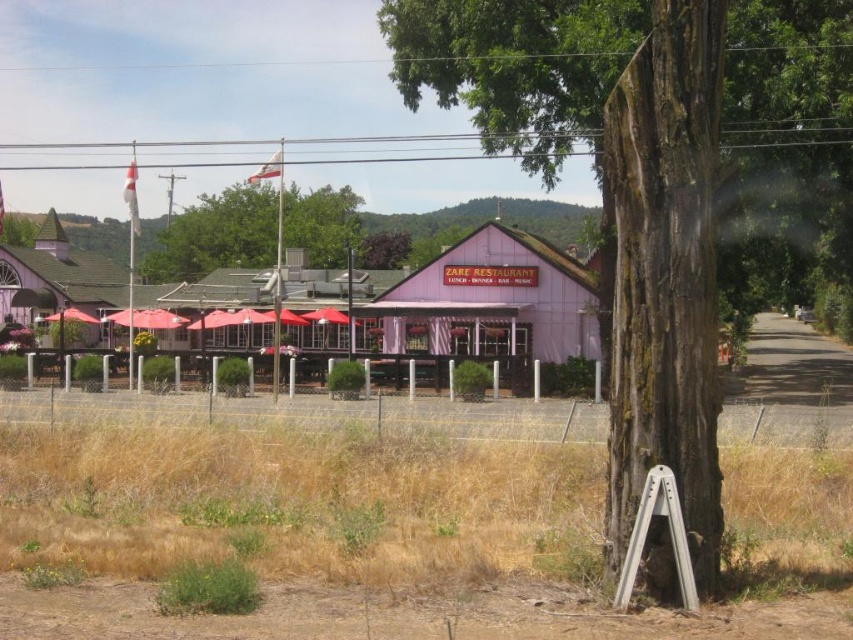
You are standing in front of the purple wood zare restaurant at center and want to take a photo of it with the smooth bark tree at center in the background. Given their sizes, will the tree block the restaurant in the photo?

The smooth bark tree at center is larger in size compared to the purple wood zare restaurant at center, so it will block the restaurant in the photo.

You are a delivery person who needs to park your 10 feet wide delivery truck between the smooth bark tree at center and the matte white tent at left. Is there enough space between them to park your truck?

The smooth bark tree at center and the matte white tent at left are 82.49 feet apart from each other, so yes, the delivery truck can park between them since the distance is more than enough for its 10 feet width.

You are standing in front of the purple wood zare restaurant at center and want to walk towards the smooth bark tree at center. Which direction should you move?

You should move to your right because the smooth bark tree at center is located to the right of the purple wood zare restaurant at center.